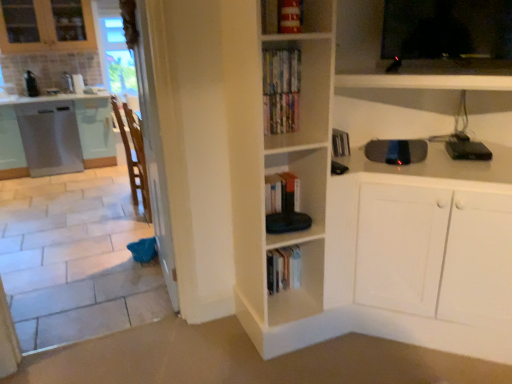
Where is `free space to the left of transparent plastic screen door at left`? free space to the left of transparent plastic screen door at left is located at coordinates (97, 284).